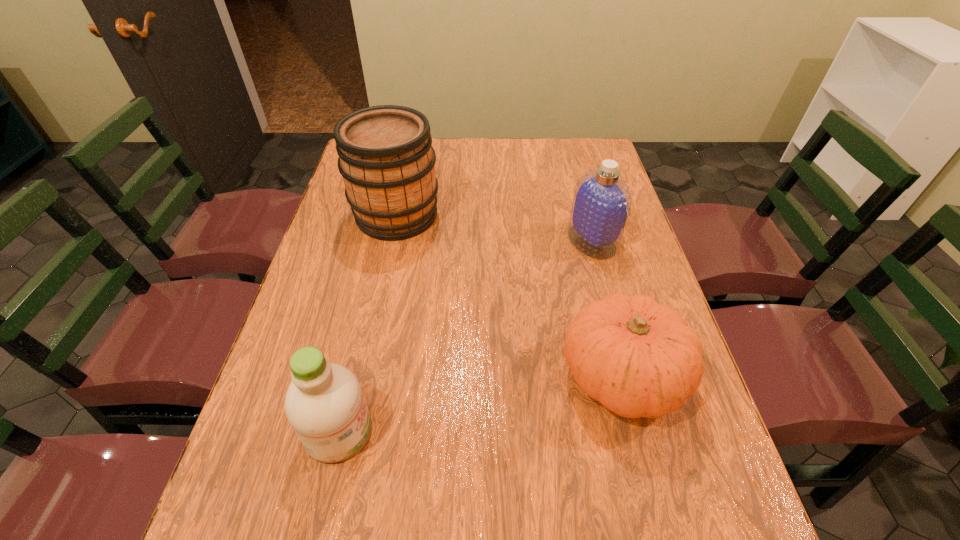
You are a GUI agent. You are given a task and a screenshot of the screen. Output one action in this format:
    pyautogui.click(x=<x>, y=<y>)
    Task: Click on the cider
    
    Given the screenshot: What is the action you would take?
    pyautogui.click(x=386, y=158)

You are a GUI agent. You are given a task and a screenshot of the screen. Output one action in this format:
    pyautogui.click(x=<x>, y=<y>)
    Task: Click on the farther cleansing agent
    
    Given the screenshot: What is the action you would take?
    pyautogui.click(x=601, y=204)

You are a GUI agent. You are given a task and a screenshot of the screen. Output one action in this format:
    pyautogui.click(x=<x>, y=<y>)
    Task: Click on the nearer cleansing agent
    
    Given the screenshot: What is the action you would take?
    pyautogui.click(x=324, y=403)

Locate an element on the screen. The height and width of the screenshot is (540, 960). pumpkin is located at coordinates (638, 358).

Find the location of a particular element. This screenshot has height=540, width=960. vacant space situated 0.240m on the back of the cider is located at coordinates (410, 151).

The width and height of the screenshot is (960, 540). Identify the location of vacant space located 0.300m on the left of the farther cleansing agent. (464, 241).

What are the coordinates of `free space located on the front label of the nearer cleansing agent` in the screenshot? It's located at (427, 431).

Locate an element on the screen. free space located on the back of the shortest object is located at coordinates (588, 241).

Find the location of a particular element. cider located at the left edge is located at coordinates (386, 158).

At what (x,y) coordinates should I click in order to perform the action: click on cleansing agent that is at the left edge. Please return your answer as a coordinate pair (x, y). This screenshot has width=960, height=540. Looking at the image, I should click on (324, 403).